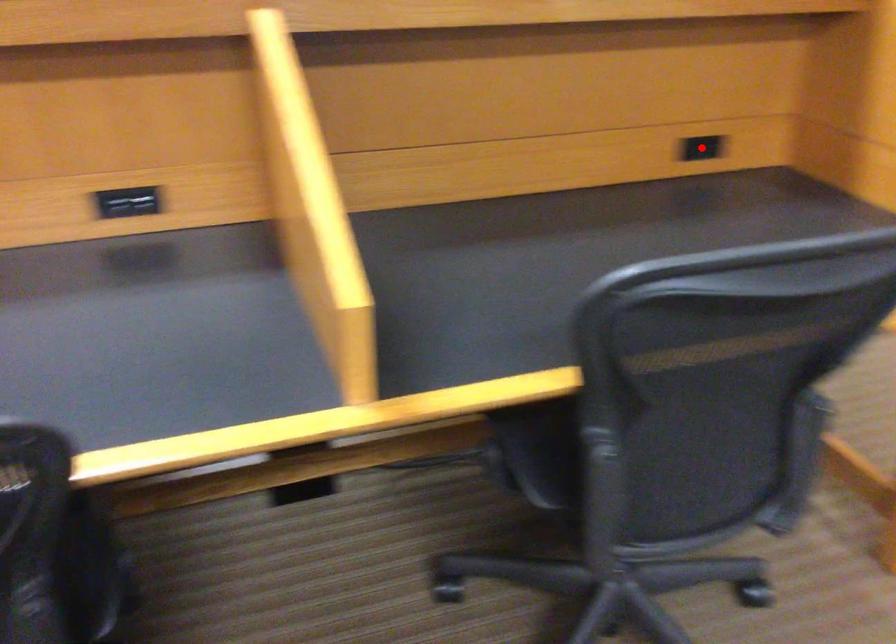
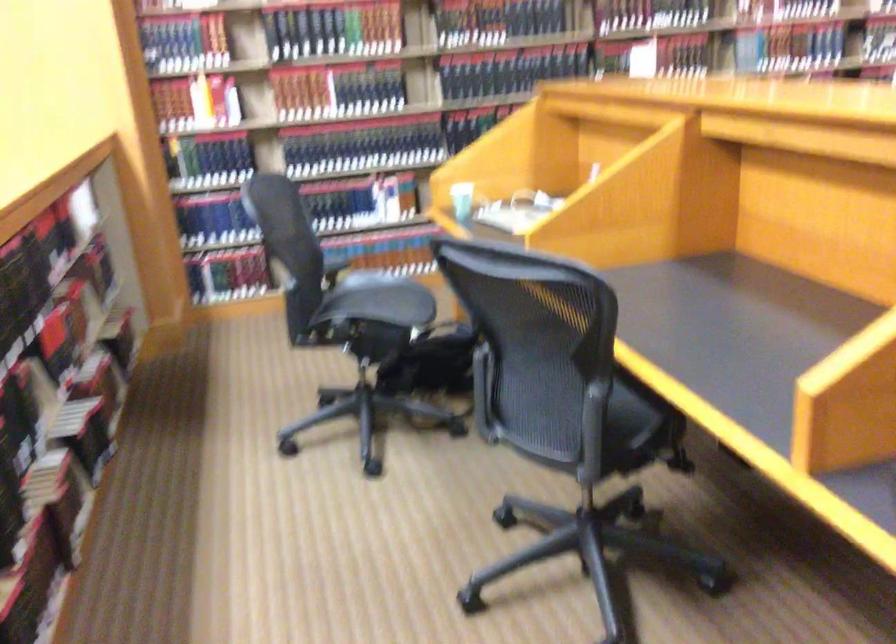
Question: I am providing you with two images of the same scene from different viewpoints. A red point is marked on the first image. At the location where the point appears in image 1, is it still visible in image 2?

Choices:
 (A) Yes
 (B) No

Answer: (B)